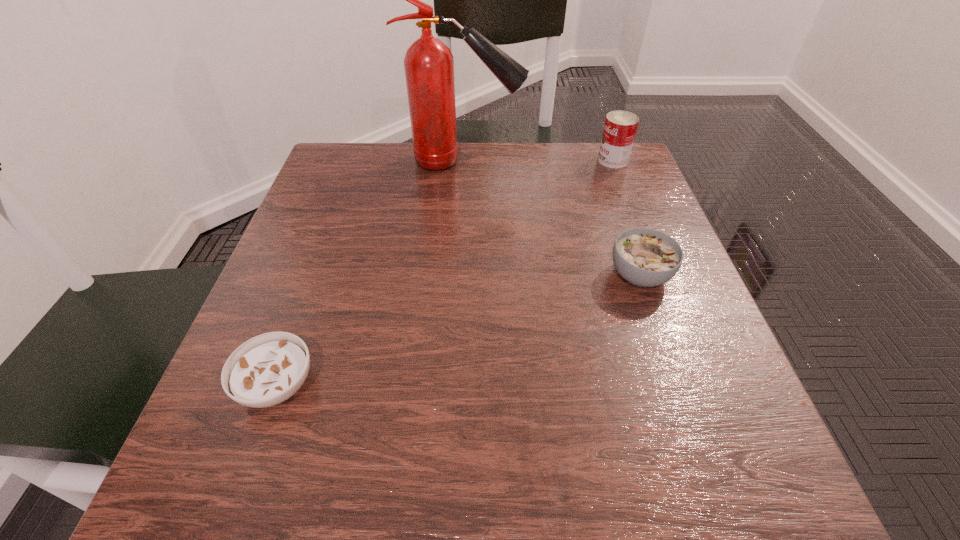
You are a GUI agent. You are given a task and a screenshot of the screen. Output one action in this format:
    pyautogui.click(x=<x>, y=<y>)
    Task: Click on the empty space that is in between the tallest object and the nearest object
    Image resolution: width=960 pixels, height=540 pixels.
    Given the screenshot: What is the action you would take?
    pyautogui.click(x=371, y=273)

The height and width of the screenshot is (540, 960). I want to click on free space between the can and the nearest object, so click(445, 273).

Find the location of a particular element. vacant area between the can and the third tallest object is located at coordinates (626, 218).

Where is `unoccupied area between the can and the taller soup bowl`? unoccupied area between the can and the taller soup bowl is located at coordinates (626, 218).

The height and width of the screenshot is (540, 960). What are the coordinates of `the second closest object to the second object from left to right` in the screenshot? It's located at (645, 257).

Select which object is the second closest to the taller soup bowl. Please provide its 2D coordinates. Your answer should be formatted as a tuple, i.e. [(x, y)], where the tuple contains the x and y coordinates of a point satisfying the conditions above.

[(429, 64)]

Locate an element on the screen. The width and height of the screenshot is (960, 540). free point that satisfies the following two spatial constraints: 1. on the front label of the can; 2. on the front side of the left soup bowl is located at coordinates (701, 385).

The width and height of the screenshot is (960, 540). In order to click on free spot that satisfies the following two spatial constraints: 1. on the front label of the can; 2. on the front side of the taller soup bowl in this screenshot , I will do `click(658, 275)`.

The image size is (960, 540). Identify the location of free space that satisfies the following two spatial constraints: 1. at the nozzle end of the taller soup bowl; 2. on the right side of the second object from left to right. click(458, 275).